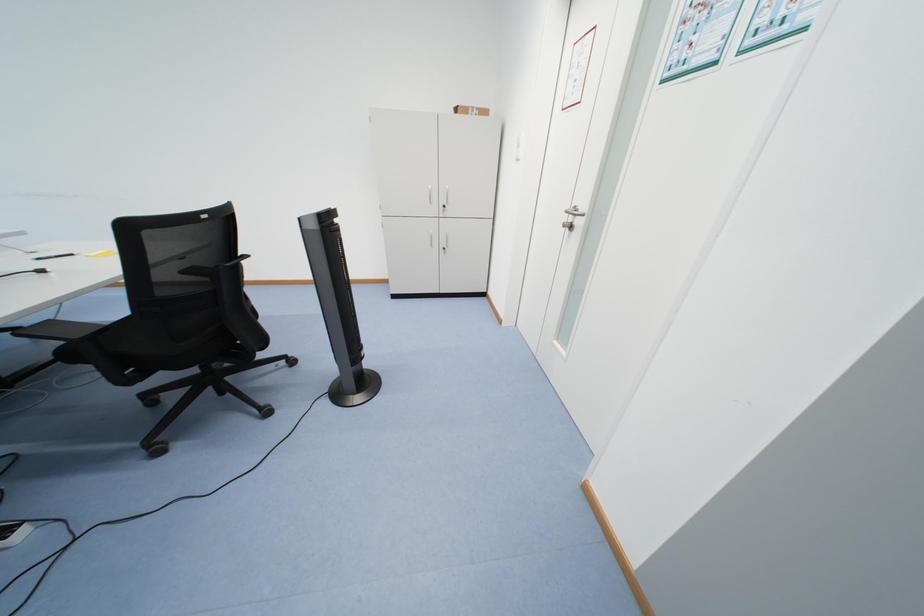
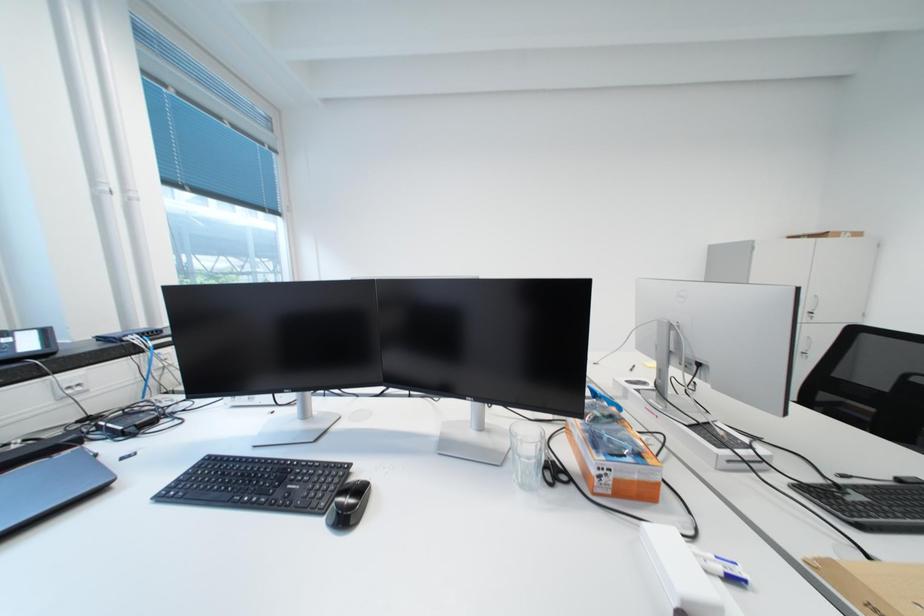
Question: Which direction would the cameraman need to move to produce the second image? Reply with the corresponding letter.

Choices:
 (A) Left
 (B) Right
 (C) Forward
 (D) Backward

Answer: (A)